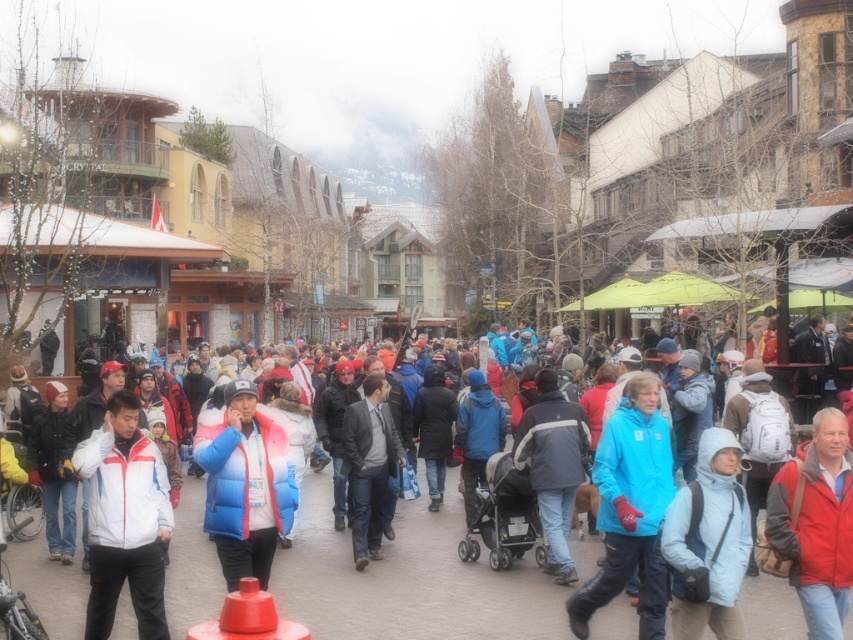
Question: In this image, where is white matte jacket at center located relative to dark gray suit at center?

Choices:
 (A) left
 (B) right

Answer: (A)

Question: Does blue matte jacket at center have a smaller size compared to red matte jacket at center-right?

Choices:
 (A) yes
 (B) no

Answer: (A)

Question: Which object is the closest to the smooth plastic cone at lower center?

Choices:
 (A) white matte jacket at center
 (B) blue matte jacket at center
 (C) red matte jacket at center-right

Answer: (A)

Question: Which object is closer to the camera taking this photo?

Choices:
 (A) blue matte jacket at center
 (B) blue/pink puffer jacket at center
 (C) dark gray suit at center

Answer: (A)

Question: Does light blue fabric jacket at lower right have a greater width compared to dark gray suit at center?

Choices:
 (A) yes
 (B) no

Answer: (A)

Question: Among these points, which one is nearest to the camera?

Choices:
 (A) (161, 470)
 (B) (811, 516)
 (C) (718, 524)
 (D) (267, 509)

Answer: (C)